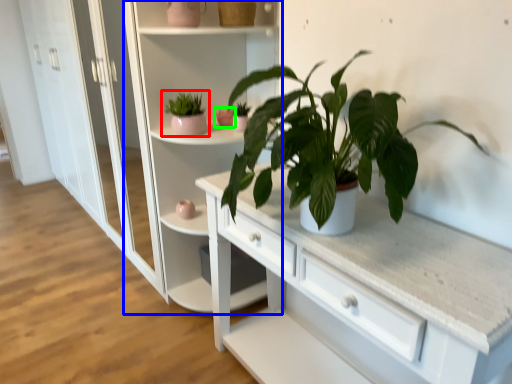
Question: Which object is positioned closest to houseplant (highlighted by a red box)? Select from bookshelf (highlighted by a blue box) and flowerpot (highlighted by a green box).

Choices:
 (A) bookshelf
 (B) flowerpot

Answer: (B)